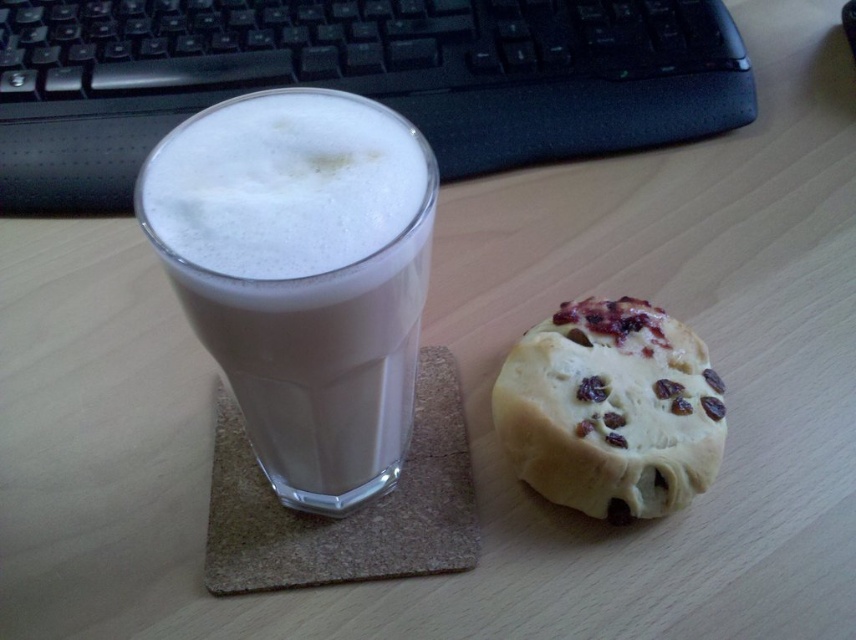
In the scene shown: Can you confirm if black plastic keyboard at upper center is taller than white frothy beverage at left?

Incorrect, black plastic keyboard at upper center's height is not larger of white frothy beverage at left's.

Does black plastic keyboard at upper center appear under white frothy beverage at left?

Incorrect, black plastic keyboard at upper center is not positioned below white frothy beverage at left.

Which is in front, point (298, 28) or point (215, 180)?

Positioned in front is point (215, 180).

Where is `black plastic keyboard at upper center`? This screenshot has height=640, width=856. black plastic keyboard at upper center is located at coordinates (357, 77).

Does white frothy beverage at left have a greater width compared to golden crumbly biscuit at right?

Incorrect, white frothy beverage at left's width does not surpass golden crumbly biscuit at right's.

Between white frothy beverage at left and golden crumbly biscuit at right, which one appears on the right side from the viewer's perspective?

golden crumbly biscuit at right is more to the right.

This screenshot has height=640, width=856. Describe the element at coordinates (302, 276) in the screenshot. I see `white frothy beverage at left` at that location.

This screenshot has width=856, height=640. What are the coordinates of `white frothy beverage at left` in the screenshot? It's located at (302, 276).

Consider the image. Which is below, black plastic keyboard at upper center or golden crumbly biscuit at right?

golden crumbly biscuit at right

From the picture: Who is taller, black plastic keyboard at upper center or golden crumbly biscuit at right?

black plastic keyboard at upper center is taller.

Between point (135, 68) and point (651, 458), which one is positioned behind?

The point (135, 68) is behind.

Locate an element on the screen. This screenshot has width=856, height=640. black plastic keyboard at upper center is located at coordinates (357, 77).